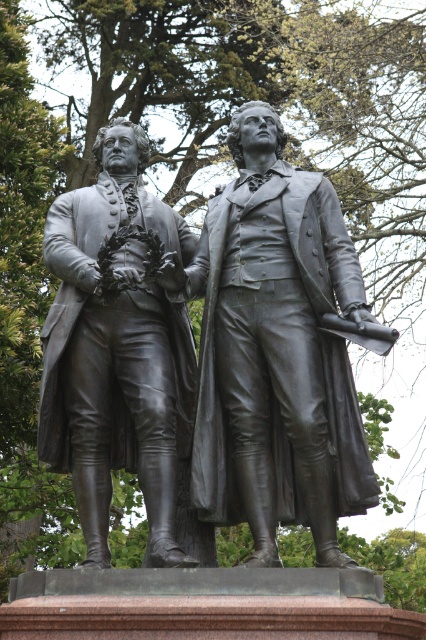
You are a tour guide explaining the historical significance of the two bronze statues. You need to mention their positions relative to each other. How far apart are the bronze statue at center and the bronze statue at left?

The bronze statue at center and the bronze statue at left are 7.08 feet apart from each other.

You are standing at a point where the camera is placed to take a photo of the bronze statue at center. If you want to move closer to the statue by 10 meters, how far will you be from the statue?

The bronze statue at center and camera are 55.66 meters apart. If you move closer by 10 meters, you will be 55.66 minus 10 equals 45.66 meters away from the bronze statue at center.